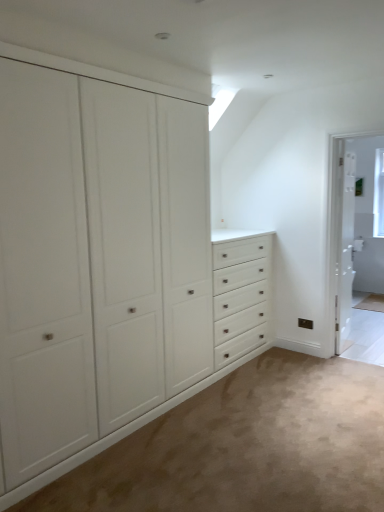
Question: Does white wooden screen door at right come behind white glossy door at right?

Choices:
 (A) yes
 (B) no

Answer: (B)

Question: Considering the relative sizes of white wooden screen door at right and white glossy door at right in the image provided, is white wooden screen door at right bigger than white glossy door at right?

Choices:
 (A) yes
 (B) no

Answer: (B)

Question: Is white wooden screen door at right outside white glossy door at right?

Choices:
 (A) yes
 (B) no

Answer: (A)

Question: Does white wooden screen door at right have a lesser height compared to white glossy door at right?

Choices:
 (A) yes
 (B) no

Answer: (B)

Question: Is white wooden screen door at right smaller than white glossy door at right?

Choices:
 (A) no
 (B) yes

Answer: (B)

Question: From a real-world perspective, is white matte cabinet at left positioned above or below white glossy door at right?

Choices:
 (A) above
 (B) below

Answer: (A)

Question: In terms of height, does white matte cabinet at left look taller or shorter compared to white glossy door at right?

Choices:
 (A) short
 (B) tall

Answer: (B)

Question: Visually, is white matte cabinet at left positioned to the left or to the right of white glossy door at right?

Choices:
 (A) right
 (B) left

Answer: (B)

Question: Is white matte cabinet at left bigger or smaller than white glossy door at right?

Choices:
 (A) big
 (B) small

Answer: (A)

Question: From a real-world perspective, is white glossy door at right physically located above or below white wooden screen door at right?

Choices:
 (A) above
 (B) below

Answer: (B)

Question: Is white glossy door at right to the left or to the right of white wooden screen door at right in the image?

Choices:
 (A) right
 (B) left

Answer: (A)

Question: Based on their sizes in the image, would you say white glossy door at right is bigger or smaller than white wooden screen door at right?

Choices:
 (A) big
 (B) small

Answer: (A)

Question: Considering the positions of white glossy door at right and white wooden screen door at right in the image, is white glossy door at right taller or shorter than white wooden screen door at right?

Choices:
 (A) short
 (B) tall

Answer: (A)

Question: In the image, is white matte cabinet at left positioned in front of or behind white wooden screen door at right?

Choices:
 (A) front
 (B) behind

Answer: (A)

Question: From their relative heights in the image, would you say white matte cabinet at left is taller or shorter than white wooden screen door at right?

Choices:
 (A) tall
 (B) short

Answer: (A)